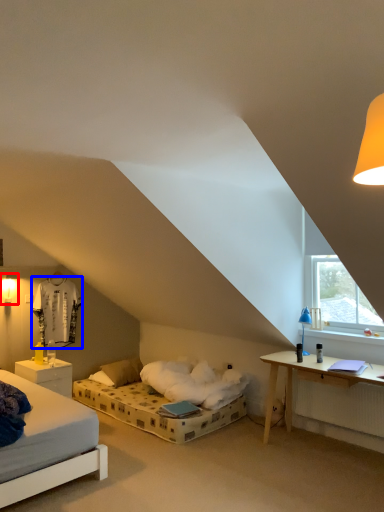
Question: Which object is closer to the camera taking this photo, light fixture (highlighted by a red box) or sheet (highlighted by a blue box)?

Choices:
 (A) light fixture
 (B) sheet

Answer: (A)